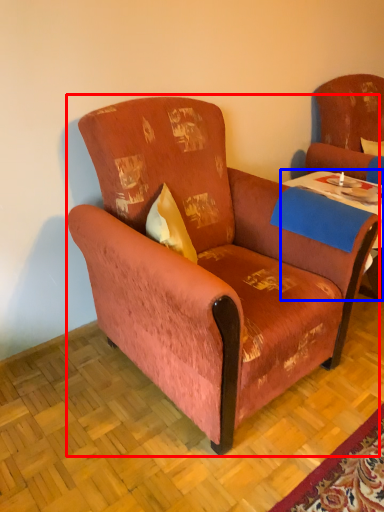
Question: Which point is further to the camera, chair (highlighted by a red box) or table (highlighted by a blue box)?

Choices:
 (A) chair
 (B) table

Answer: (B)